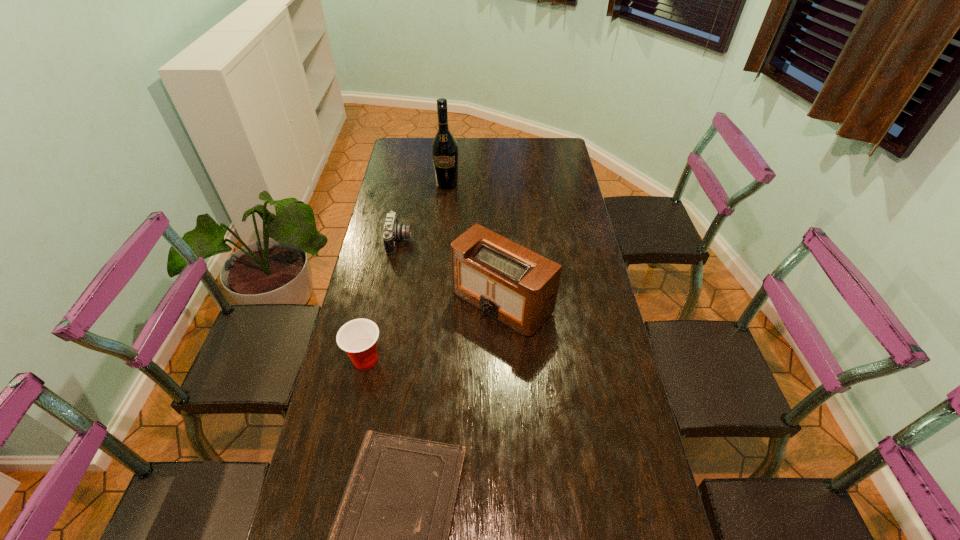
Locate an element on the screen. The image size is (960, 540). empty space that is in between the tallest object and the third shortest object is located at coordinates (406, 272).

Locate an element on the screen. free area in between the camera and the radio receiver is located at coordinates (451, 272).

The height and width of the screenshot is (540, 960). What are the coordinates of `empty space between the wine bottle and the camera` in the screenshot? It's located at (423, 213).

At what (x,y) coordinates should I click in order to perform the action: click on unoccupied position between the third shortest object and the camera. Please return your answer as a coordinate pair (x, y). The width and height of the screenshot is (960, 540). Looking at the image, I should click on (383, 300).

Locate an element on the screen. The width and height of the screenshot is (960, 540). vacant space that is in between the cup and the wine bottle is located at coordinates click(406, 272).

This screenshot has height=540, width=960. I want to click on the second closest object to the nearest object, so click(516, 286).

Identify the location of object that can be found as the third closest to the tallest object. (358, 338).

The width and height of the screenshot is (960, 540). Find the location of `vacant point that satisfies the following two spatial constraints: 1. on the label of the radio receiver; 2. on the left side of the farthest object`. vacant point that satisfies the following two spatial constraints: 1. on the label of the radio receiver; 2. on the left side of the farthest object is located at coordinates (436, 302).

Locate an element on the screen. free spot that satisfies the following two spatial constraints: 1. on the label of the tallest object; 2. on the front-facing side of the second farthest object is located at coordinates (442, 241).

This screenshot has height=540, width=960. I want to click on free space that satisfies the following two spatial constraints: 1. on the label of the wine bottle; 2. on the front-facing side of the camera, so click(x=442, y=241).